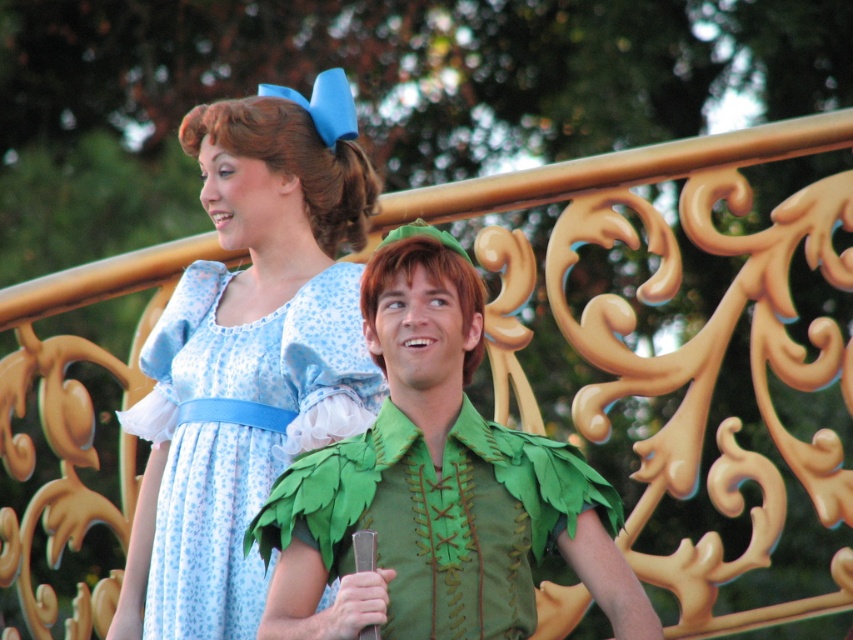
You are a photographer setting up for a group photo. You need to position the green felt vest at center and the blue printed fabric dress at center so that they are exactly 5 meters apart. Based on their current positions, do you need to move them closer together or farther apart?

The green felt vest at center is currently 4.42 meters from the blue printed fabric dress at center. To reach the desired 5 meters, you need to move them farther apart.

You are standing in front of the two costumed individuals near the golden railing. You need to walk to a specific point. Which of the two points, point 1 at coordinates point (467, 424) or point 2 at coordinates point (143, 428), is closer to you as you face the scene?

Point 1 at coordinates point (467, 424) is closer to you because it is in front of point 2 at coordinates point (143, 428).

Looking at this image, you are a costume designer observing the two characters in the image. You need to determine which costume element is taller between the green felt vest at center and the blue printed fabric dress at center. Which one is taller?

The green felt vest at center is taller than the blue printed fabric dress at center according to the description.